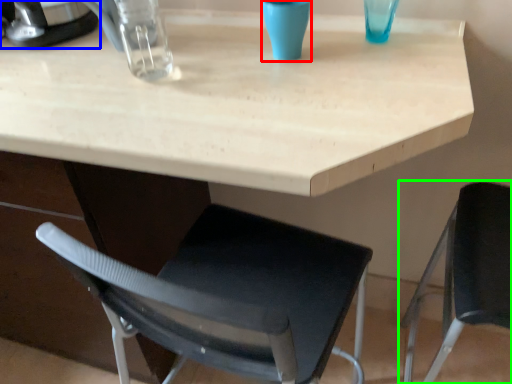
Question: Considering the real-world distances, which object is farthest from clear (highlighted by a red box)? appliance (highlighted by a blue box) or chair (highlighted by a green box)?

Choices:
 (A) appliance
 (B) chair

Answer: (B)